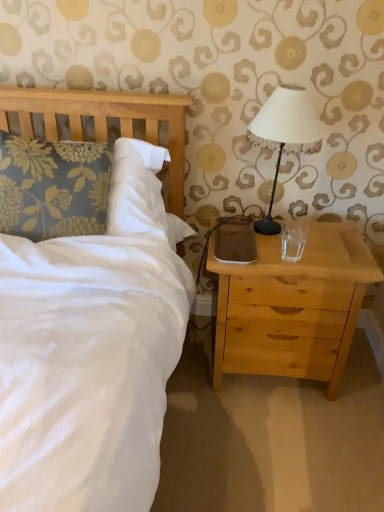
The width and height of the screenshot is (384, 512). Identify the location of free space in front of white fabric-covered lampshade at upper right. (296, 258).